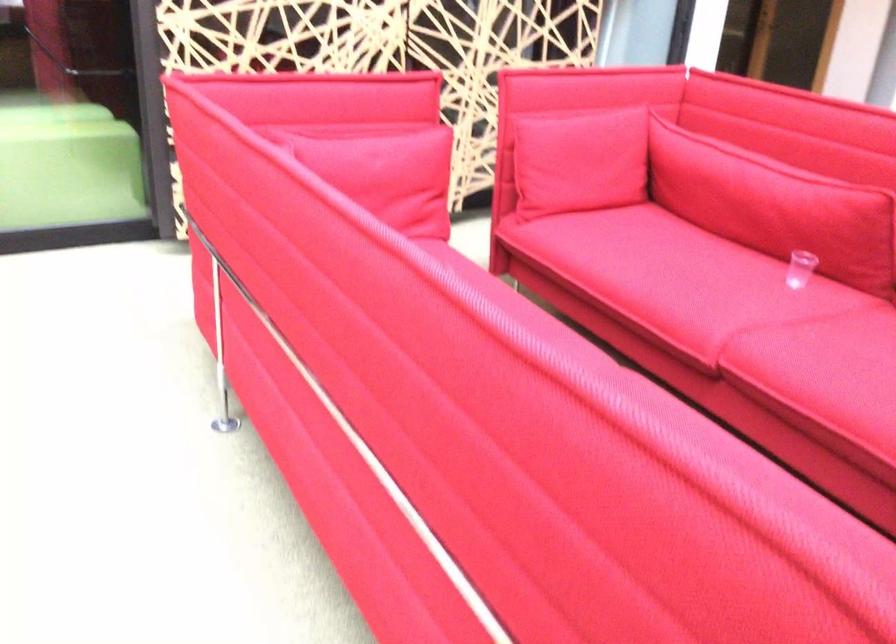
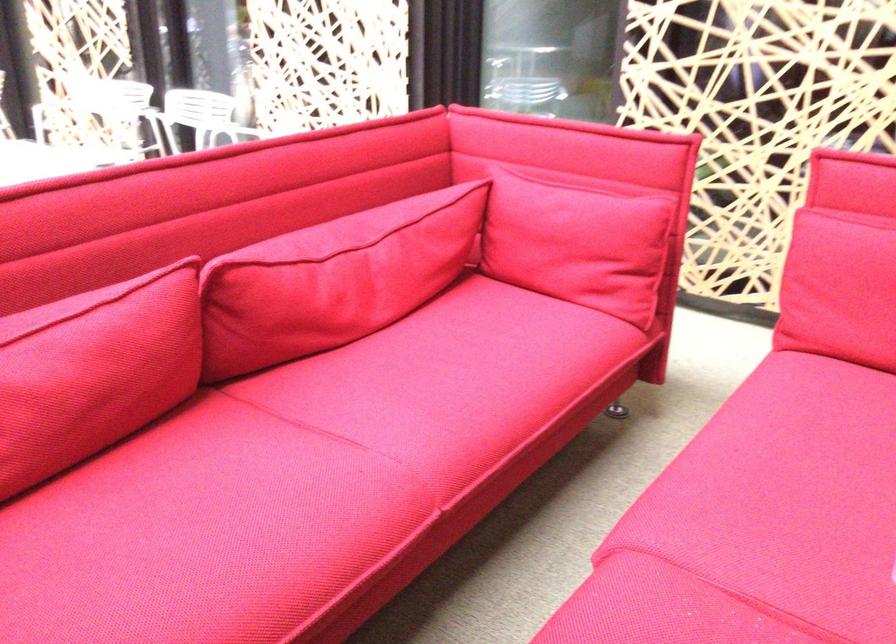
Question: I am providing you with two images of the same scene from different viewpoints. After the viewpoint changes to image2, which objects are now occluded?

Choices:
 (A) red sofa sitting surface
 (B) red sofa cushion
 (C) red sofa armrest
 (D) none of these

Answer: (D)